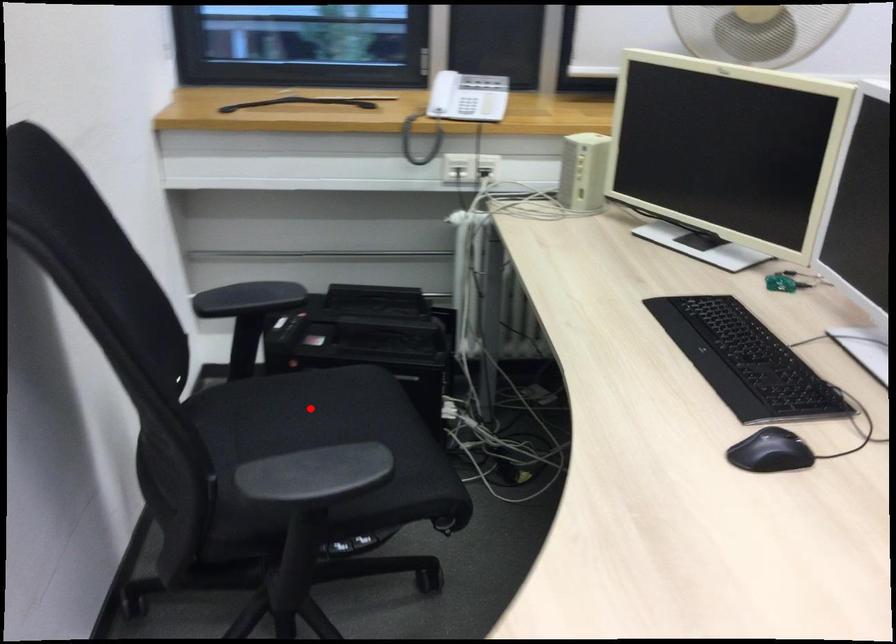
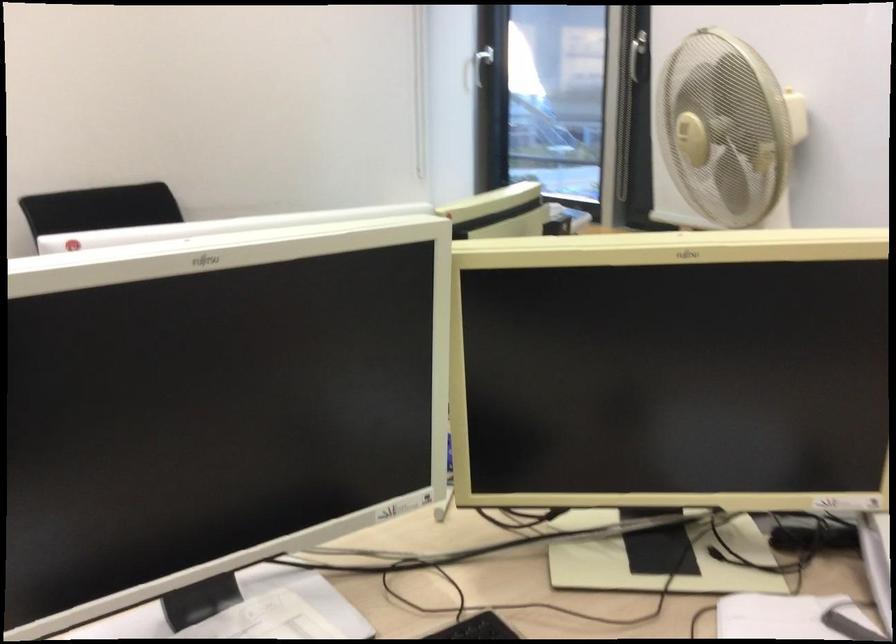
Question: I am providing you with two images of the same scene from different viewpoints. A red point is marked on the first image. Can you still see the location of the red point in image 2?

Choices:
 (A) Yes
 (B) No

Answer: (B)